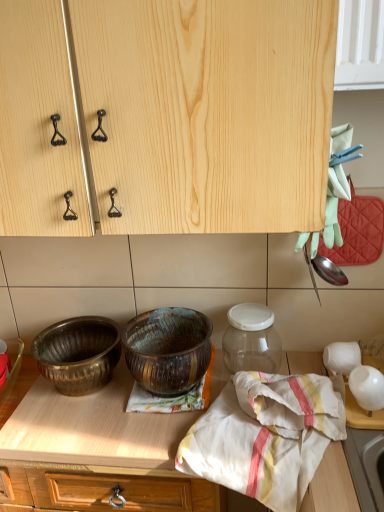
The height and width of the screenshot is (512, 384). In order to click on vacant space underneath polished brass bowl at lower left, which is counted as the first bowl, starting from the left (from a real-world perspective) in this screenshot , I will do `click(80, 390)`.